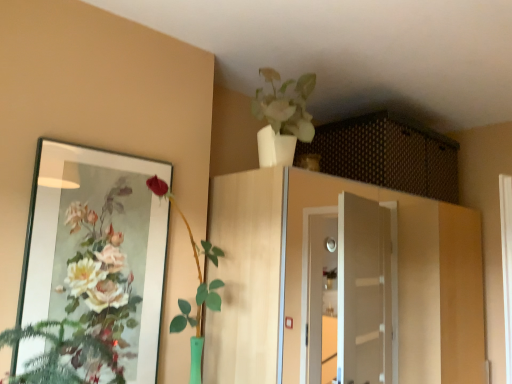
Question: Is white glossy vase at upper center, which is the 2th houseplant in left-to-right order, to the right of brown woven basket at upper center, acting as the first cabinetry starting from the top, from the viewer's perspective?

Choices:
 (A) yes
 (B) no

Answer: (B)

Question: Is white glossy vase at upper center, the 1th houseplant positioned from the right, wider than brown woven basket at upper center, the 2th cabinetry in the bottom-to-top sequence?

Choices:
 (A) yes
 (B) no

Answer: (B)

Question: Can you confirm if white glossy vase at upper center, which is counted as the 2th houseplant, starting from the bottom, is bigger than brown woven basket at upper center, acting as the first cabinetry starting from the top?

Choices:
 (A) no
 (B) yes

Answer: (A)

Question: From the image's perspective, is white glossy vase at upper center, which is the 2th houseplant in left-to-right order, on top of brown woven basket at upper center, acting as the first cabinetry starting from the top?

Choices:
 (A) no
 (B) yes

Answer: (B)

Question: Would you say white glossy vase at upper center, the 1th houseplant positioned from the right, contains brown woven basket at upper center, acting as the first cabinetry starting from the top?

Choices:
 (A) no
 (B) yes

Answer: (A)

Question: From a real-world perspective, relative to wooden cabinet at center, positioned as the 1th cabinetry in bottom-to-top order, is brown woven basket at upper center, the 2th cabinetry in the bottom-to-top sequence, vertically above or below?

Choices:
 (A) above
 (B) below

Answer: (A)

Question: Does point (404, 148) appear closer or farther from the camera than point (437, 337)?

Choices:
 (A) closer
 (B) farther

Answer: (A)

Question: Is brown woven basket at upper center, acting as the first cabinetry starting from the top, bigger or smaller than wooden cabinet at center, positioned as the 1th cabinetry in bottom-to-top order?

Choices:
 (A) big
 (B) small

Answer: (B)

Question: In the image, is brown woven basket at upper center, the 2th cabinetry in the bottom-to-top sequence, positioned in front of or behind wooden cabinet at center, positioned as the 1th cabinetry in bottom-to-top order?

Choices:
 (A) behind
 (B) front

Answer: (A)

Question: Is point (200, 291) positioned closer to the camera than point (358, 188)?

Choices:
 (A) closer
 (B) farther

Answer: (A)

Question: Considering their positions, is green glass vase at left, which is the 1th houseplant in left-to-right order, located in front of or behind wooden cabinet at center, acting as the 2th cabinetry starting from the top?

Choices:
 (A) front
 (B) behind

Answer: (A)

Question: From a real-world perspective, is green glass vase at left, the first houseplant from the bottom, positioned above or below wooden cabinet at center, acting as the 2th cabinetry starting from the top?

Choices:
 (A) above
 (B) below

Answer: (A)

Question: In terms of size, does green glass vase at left, which is counted as the second houseplant, starting from the right, appear bigger or smaller than wooden cabinet at center, acting as the 2th cabinetry starting from the top?

Choices:
 (A) big
 (B) small

Answer: (B)

Question: Which is correct: wooden cabinet at center, acting as the 2th cabinetry starting from the top, is inside green glass vase at left, the 2th houseplant from the top, or outside of it?

Choices:
 (A) inside
 (B) outside

Answer: (B)

Question: From the image's perspective, is wooden cabinet at center, positioned as the 1th cabinetry in bottom-to-top order, located above or below green glass vase at left, the 2th houseplant from the top?

Choices:
 (A) above
 (B) below

Answer: (B)